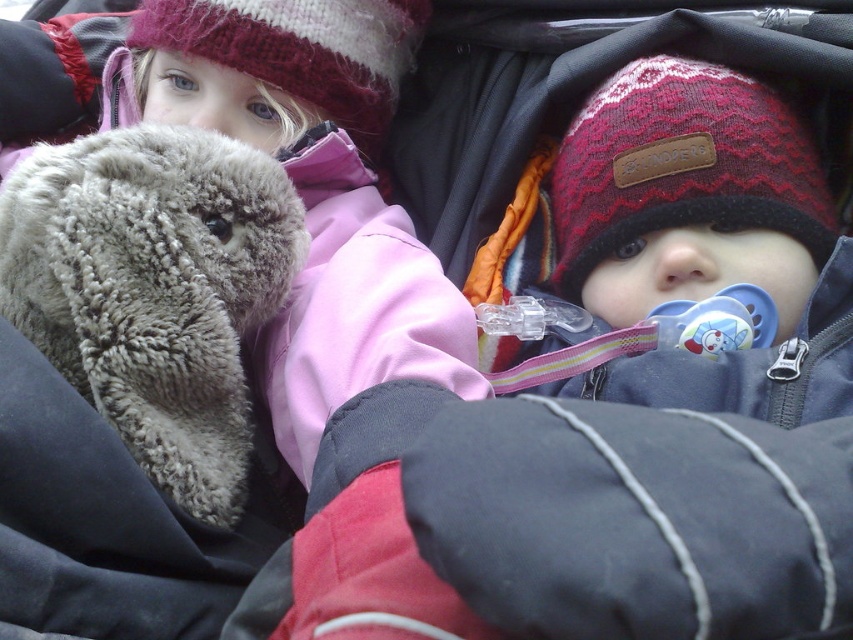
You are a parent trying to decide which toy to give to your child. Both the fuzzy gray stuffed animal at left and the fuzzy gray teddy bear at left are available. If you want to choose the taller one, which should you pick?

The fuzzy gray teddy bear at left is taller than the fuzzy gray stuffed animal at left, so you should pick the fuzzy gray teddy bear at left.

You are a tailor observing two knitted woolen hats in the image. The hats are labeled as knitted woolen hat at upper right and knitted woolen hat at upper left. Based on their sizes, which one would require more yarn to produce?

The knitted woolen hat at upper right requires more yarn because it is bigger than the knitted woolen hat at upper left.

Based on the photo, you are a photographer taking a picture of the two knitted woolen hats. The camera can only focus on objects within a certain height range. The knitted woolen hat at upper left is within the focus range. Would the knitted woolen hat at upper right also be in focus?

The knitted woolen hat at upper right is much taller than the knitted woolen hat at upper left. Since the camera focuses on objects within a certain height range and the knitted woolen hat at upper left is within range, the taller knitted woolen hat at upper right might be outside the focus range if it exceeds the maximum height limit.